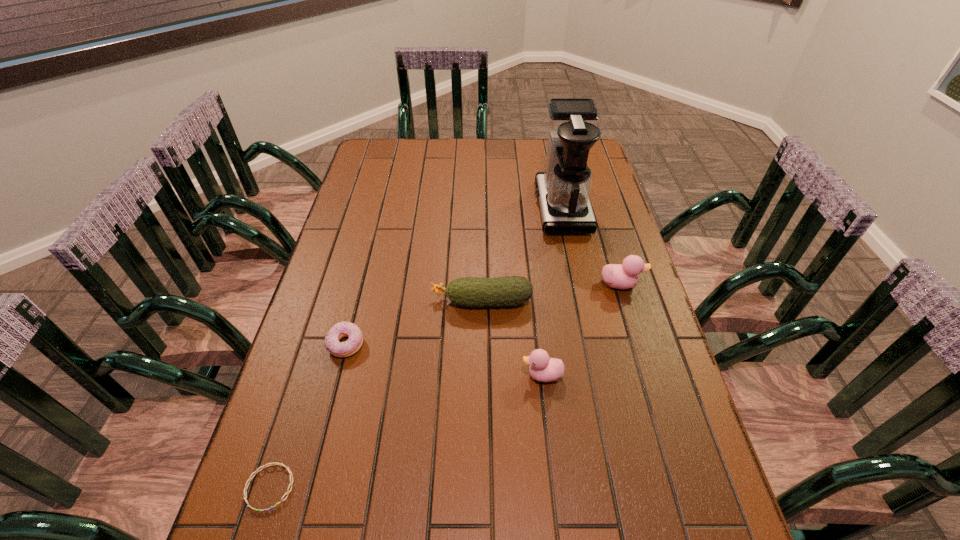
Locate an element on the screen. This screenshot has height=540, width=960. vacant space located at the blossom end of the cucumber is located at coordinates (373, 301).

I want to click on object that is at the near edge, so [x=274, y=463].

At what (x,y) coordinates should I click in order to perform the action: click on doughnut that is at the left edge. Please return your answer as a coordinate pair (x, y). The width and height of the screenshot is (960, 540). Looking at the image, I should click on (342, 329).

At what (x,y) coordinates should I click in order to perform the action: click on bracelet present at the left edge. Please return your answer as a coordinate pair (x, y). Image resolution: width=960 pixels, height=540 pixels. Looking at the image, I should click on (274, 463).

Where is `duckling present at the right edge`? Image resolution: width=960 pixels, height=540 pixels. duckling present at the right edge is located at coordinates (625, 276).

The width and height of the screenshot is (960, 540). I want to click on coffee maker located in the right edge section of the desktop, so click(563, 190).

Find the location of a particular element. This screenshot has width=960, height=540. object that is at the near left corner is located at coordinates (274, 463).

The image size is (960, 540). I want to click on free space at the far edge of the desktop, so click(x=520, y=140).

Find the location of a particular element. This screenshot has width=960, height=540. vacant area at the near edge is located at coordinates (417, 503).

Locate an element on the screen. This screenshot has width=960, height=540. free space at the left edge of the desktop is located at coordinates (326, 457).